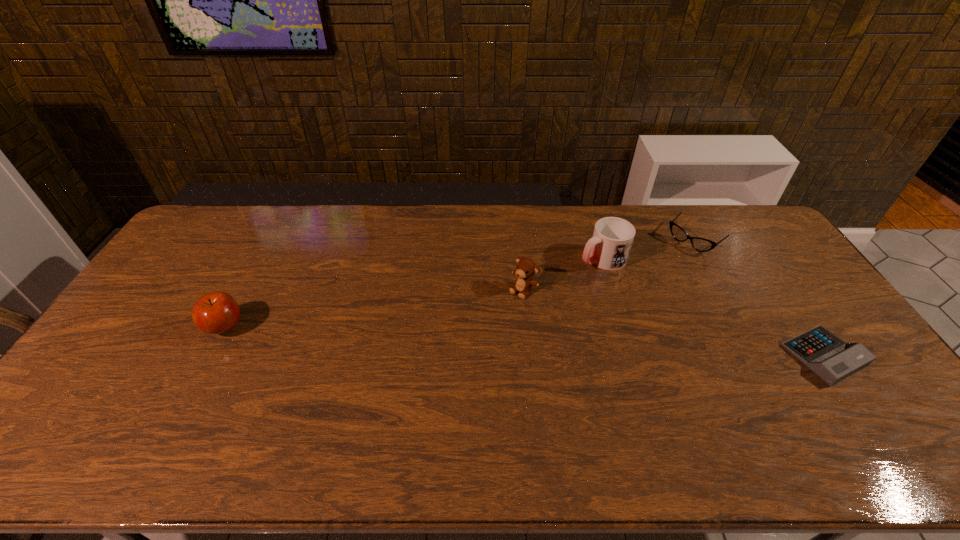
The image size is (960, 540). Find the location of `apple`. apple is located at coordinates (216, 313).

I want to click on calculator, so click(831, 359).

Locate an element on the screen. The width and height of the screenshot is (960, 540). mug is located at coordinates (608, 249).

The height and width of the screenshot is (540, 960). In order to click on the fourth tallest object in this screenshot , I will do `click(700, 244)`.

Identify the location of teddy bear. The image size is (960, 540). (526, 267).

This screenshot has width=960, height=540. Find the location of `the fourth object from right to left`. the fourth object from right to left is located at coordinates (526, 267).

This screenshot has width=960, height=540. What are the coordinates of `free space located on the left of the leftmost object` in the screenshot? It's located at (154, 327).

At what (x,y) coordinates should I click in order to perform the action: click on vacant space located 0.260m on the back of the shortest object. Please return your answer as a coordinate pair (x, y). Looking at the image, I should click on (763, 267).

Image resolution: width=960 pixels, height=540 pixels. In order to click on vacant region located on the side of the mug with the handle in this screenshot , I will do `click(563, 276)`.

Locate an element on the screen. The image size is (960, 540). vacant space located 0.190m on the side of the mug with the handle is located at coordinates (538, 288).